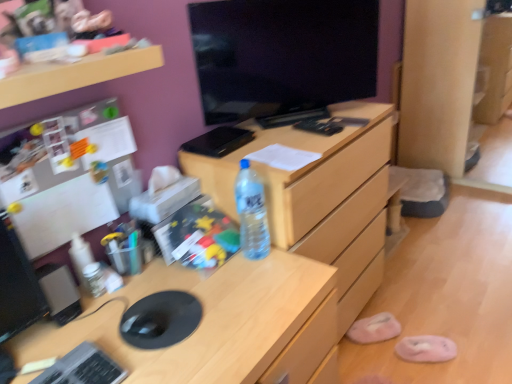
Locate an element on the screen. The width and height of the screenshot is (512, 384). free space above pink fabric slipper at lower right, arranged as the first slipper when viewed from the left (from a real-world perspective) is located at coordinates (373, 321).